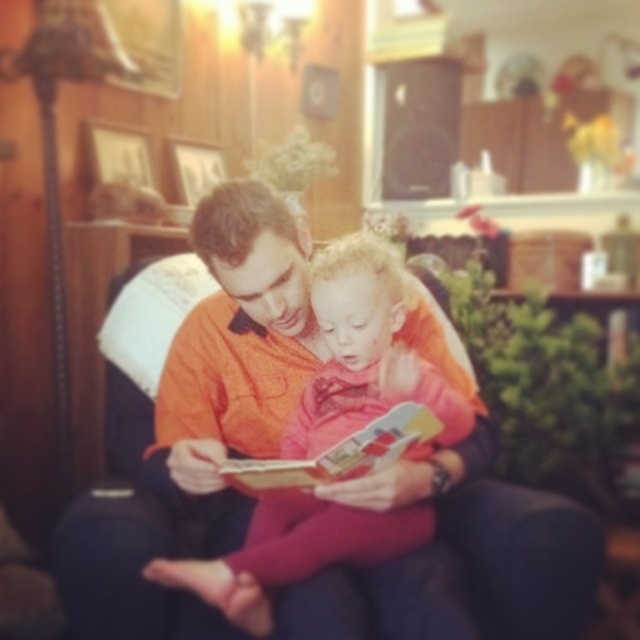
Can you confirm if pink fabric at center is wider than hardcover book at center?

Indeed, pink fabric at center has a greater width compared to hardcover book at center.

Does point (412, 544) lie in front of point (387, 417)?

No, (412, 544) is further to viewer.

Who is more distant from viewer, (326, 380) or (339, 458)?

Positioned behind is point (326, 380).

This screenshot has width=640, height=640. What are the coordinates of `pink fabric at center` in the screenshot? It's located at [x=340, y=560].